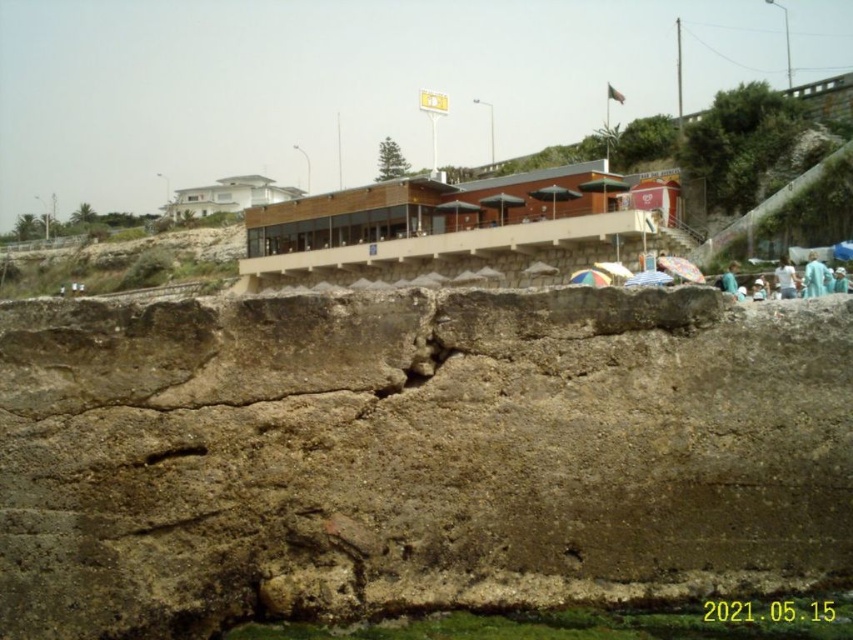
How far apart are brown rough rock at lower center and white fabric at lower right?

brown rough rock at lower center is 178.02 feet away from white fabric at lower right.

Between brown rough rock at lower center and white fabric at lower right, which one is positioned higher?

white fabric at lower right is above.

Is point (763, 436) positioned in front of point (780, 276)?

Yes, it is in front of point (780, 276).

You are a GUI agent. You are given a task and a screenshot of the screen. Output one action in this format:
    pyautogui.click(x=<x>, y=<y>)
    Task: Click on the brown rough rock at lower center
    
    Given the screenshot: What is the action you would take?
    pyautogui.click(x=413, y=454)

Which is more to the right, brown rough rock at lower center or blue fabric at lower right?

From the viewer's perspective, blue fabric at lower right appears more on the right side.

Is point (171, 456) farther from camera compared to point (805, 284)?

That is False.

Is point (822, 429) less distant than point (821, 262)?

That is True.

The image size is (853, 640). What are the coordinates of `brown rough rock at lower center` in the screenshot? It's located at (413, 454).

Measure the distance between blue fabric at lower right and camera.

They are 53.39 meters apart.

Is blue fabric at lower right smaller than light blue fabric at lower right?

Actually, blue fabric at lower right might be larger than light blue fabric at lower right.

Which is in front, point (825, 278) or point (728, 282)?

Point (825, 278) is in front.

Locate an element on the screen. blue fabric at lower right is located at coordinates (814, 276).